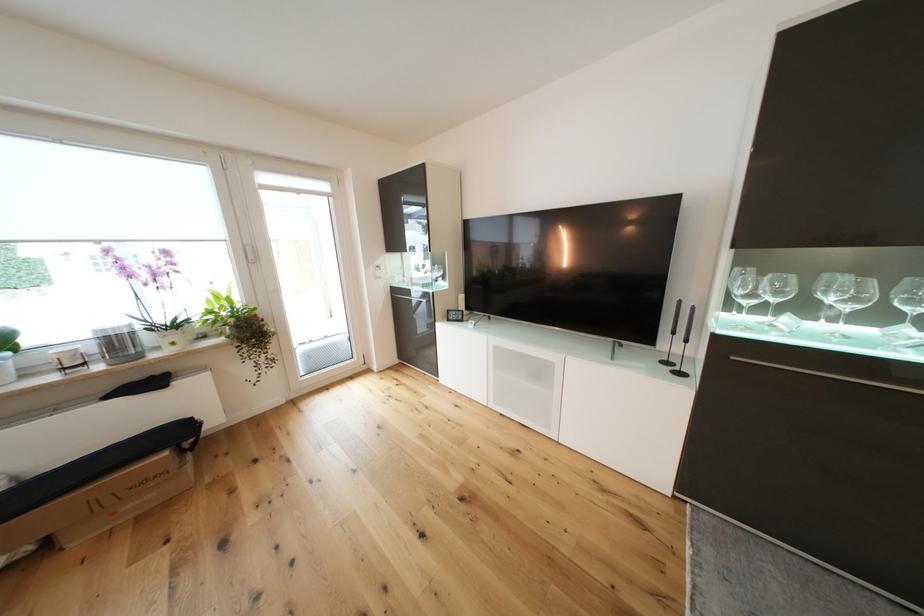
Describe the element at coordinates (614, 347) in the screenshot. I see `a silver drawer pull` at that location.